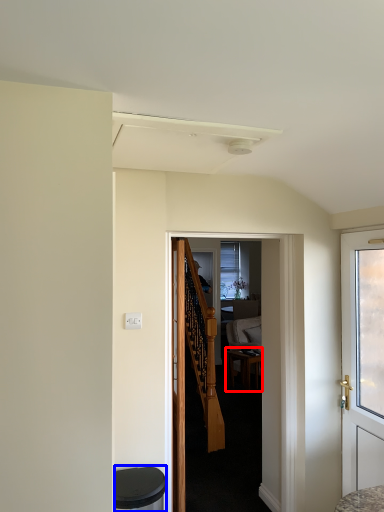
Question: Which of the following is the closest to the observer, desk (highlighted by a red box) or music stool (highlighted by a blue box)?

Choices:
 (A) desk
 (B) music stool

Answer: (B)